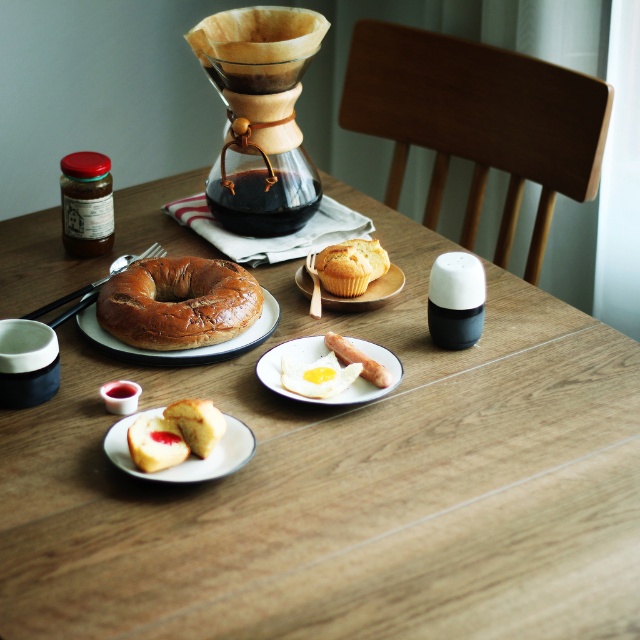
You are setting up a breakfast table and want to place a small vase of flowers exactly between the golden crumbly muffin at center and the edge of the table. According to the coordinates provided, where should you position the vase?

The golden crumbly muffin at center is located at point (349, 266). To place the vase exactly between it and the edge of the table, calculate the midpoint between these coordinates and the table edge. However, without knowing the table edge coordinates, an exact position can be determined only if the table edge is at a known point like the table boundary. Assuming the table edge is at coordinate 1.0 on the x or y axis, the midpoint would be halfway between 0.416 and 1.0, resulting in approximately 0.708,